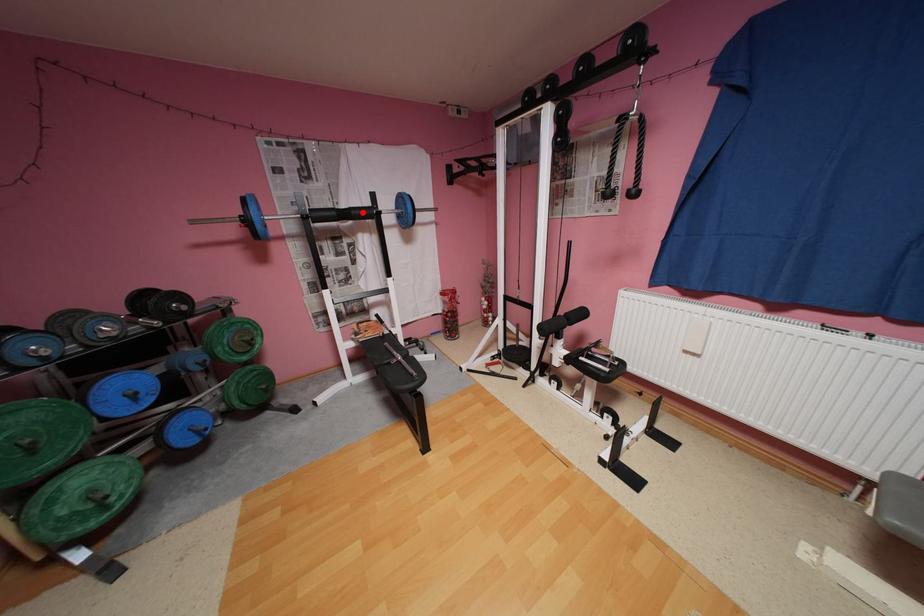
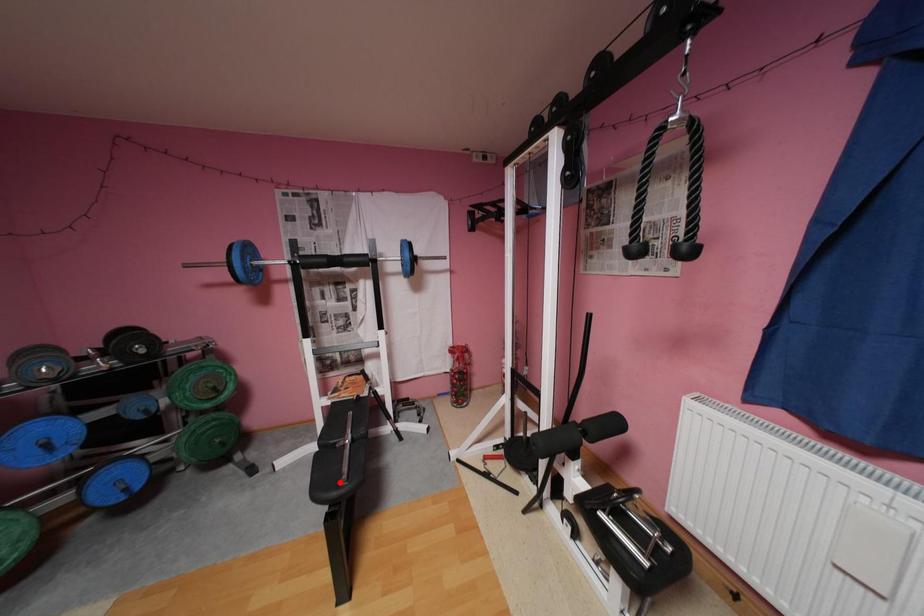
I am providing you with two images of the same scene from different viewpoints. A red point is marked on the first image and another point is marked on the second image. Does the point marked in image1 correspond to the same location as the one in image2?

No